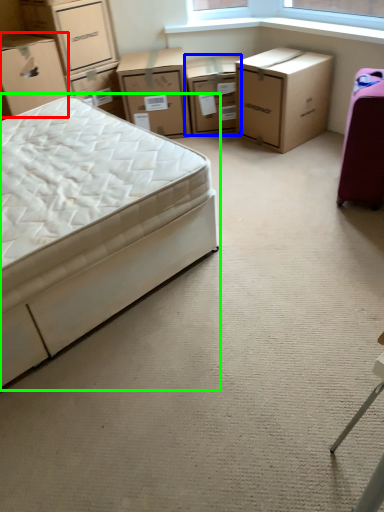
Question: Which object is positioned closest to box (highlighted by a red box)? Select from chest of drawers (highlighted by a blue box) and bed (highlighted by a green box).

Choices:
 (A) chest of drawers
 (B) bed

Answer: (B)